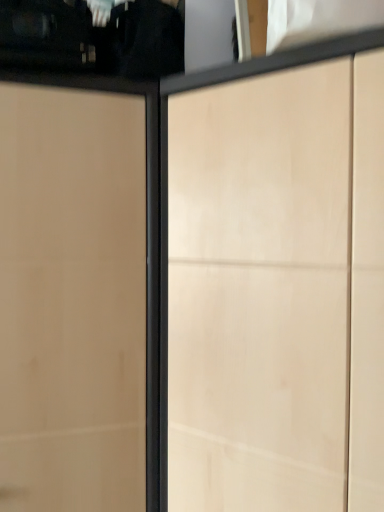
Identify the location of matte wood door at left. (72, 298).

The width and height of the screenshot is (384, 512). What do you see at coordinates (72, 298) in the screenshot? I see `matte wood door at left` at bounding box center [72, 298].

Locate an element on the screen. This screenshot has width=384, height=512. matte wood door at left is located at coordinates pos(72,298).